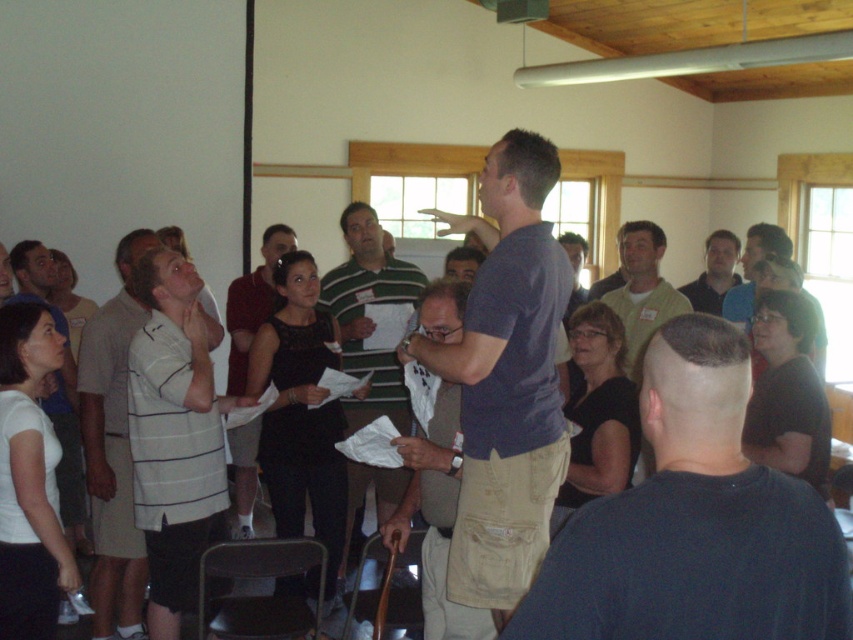
You are standing in the room and want to hand a document to both the matte black shirt at center and the green striped shirt at center. Which person should you approach first if you want to reach the taller individual first?

The green striped shirt at center is taller than the matte black shirt at center, so you should approach the green striped shirt at center first.

Where is the matte blue shirt at center located in the image?

The matte blue shirt at center is located at point coordinates of approximately 0.595 on the x axis and 0.594 on the y axis.

From the picture: You are standing in the middle of the room and see the point marked at coordinates (506, 380). What object is located exactly at that point?

The matte blue shirt at center is located exactly at point (506, 380).